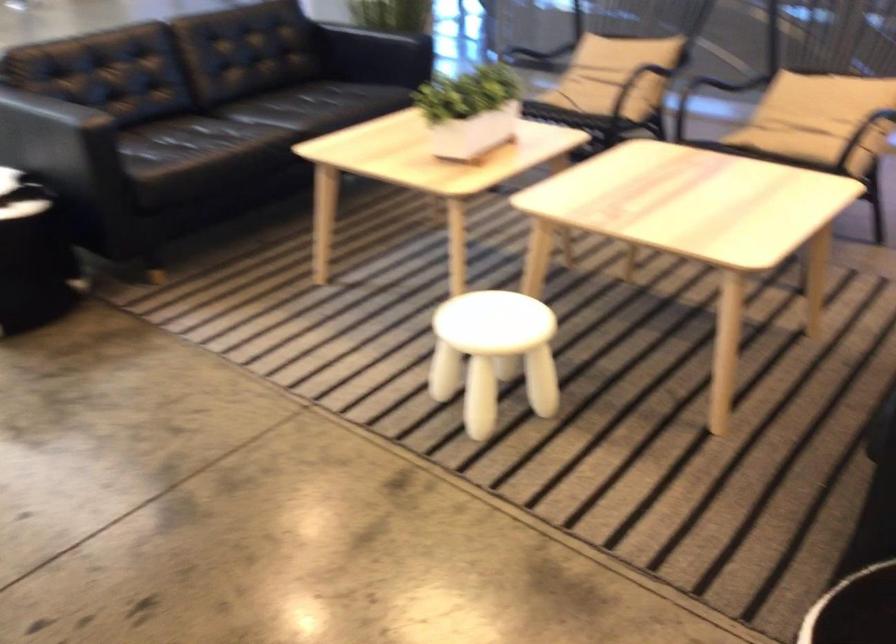
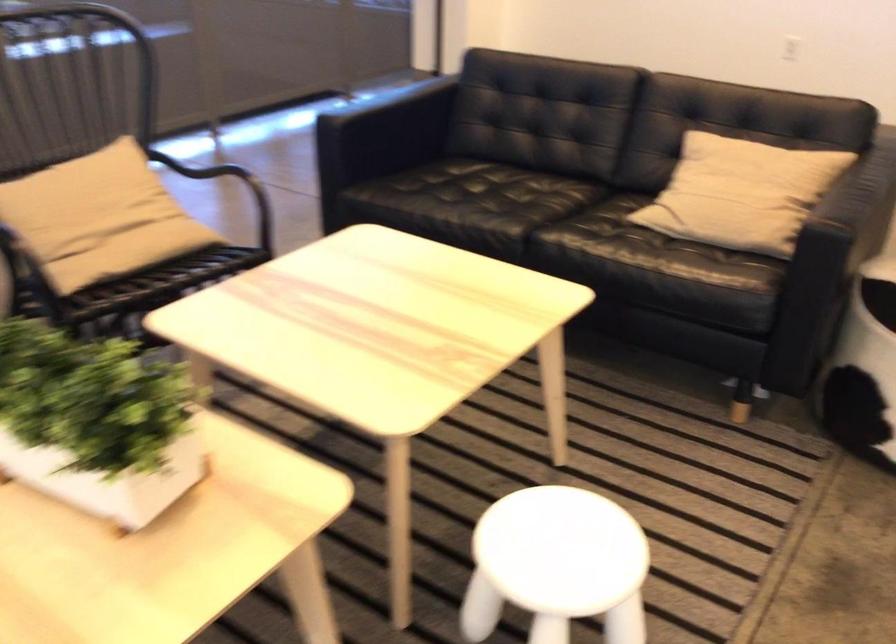
Question: I am providing you with two images of the same scene from different viewpoints. Please identify which objects are invisible in image2.

Choices:
 (A) chair armrest
 (B) white planter
 (C) food cover handle
 (D) white stool

Answer: (A)